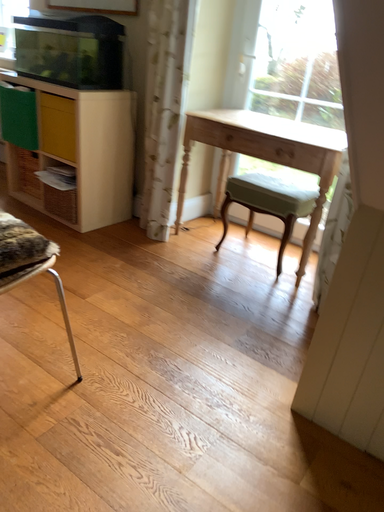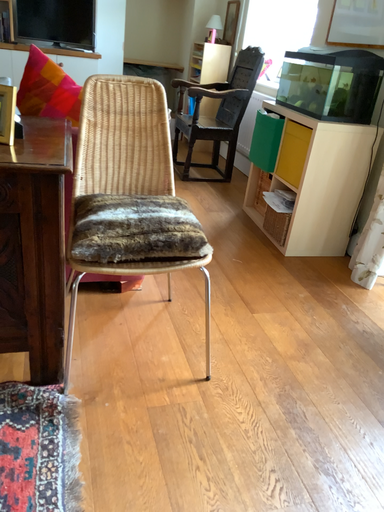
Question: Which way did the camera rotate in the video?

Choices:
 (A) rotated right
 (B) rotated left

Answer: (B)